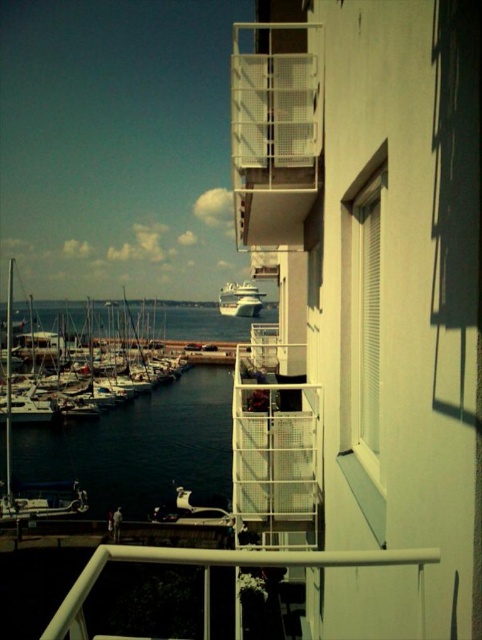
Question: Which object is farther from the camera taking this photo?

Choices:
 (A) dark blue water at lower left
 (B) white mesh balcony at upper right
 (C) smooth dark water at lower left

Answer: (A)

Question: Is smooth dark water at lower left above white glossy cruise ship at center?

Choices:
 (A) yes
 (B) no

Answer: (B)

Question: Is white mesh balcony at upper right wider than white glossy cruise ship at center?

Choices:
 (A) yes
 (B) no

Answer: (B)

Question: Which of the following is the closest to the observer?

Choices:
 (A) (306, 195)
 (B) (244, 305)
 (C) (128, 509)
 (D) (174, 320)

Answer: (A)

Question: Which is farther from the white glossy boats at left?

Choices:
 (A) white mesh balcony at upper right
 (B) white glossy cruise ship at center
 (C) smooth dark water at lower left

Answer: (B)

Question: Does smooth dark water at lower left come behind white glossy boats at left?

Choices:
 (A) no
 (B) yes

Answer: (A)